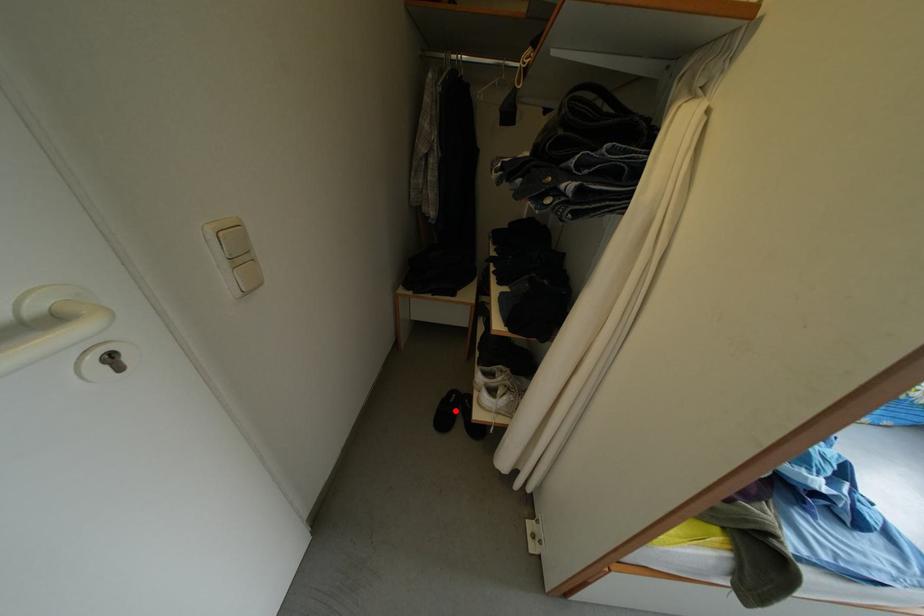
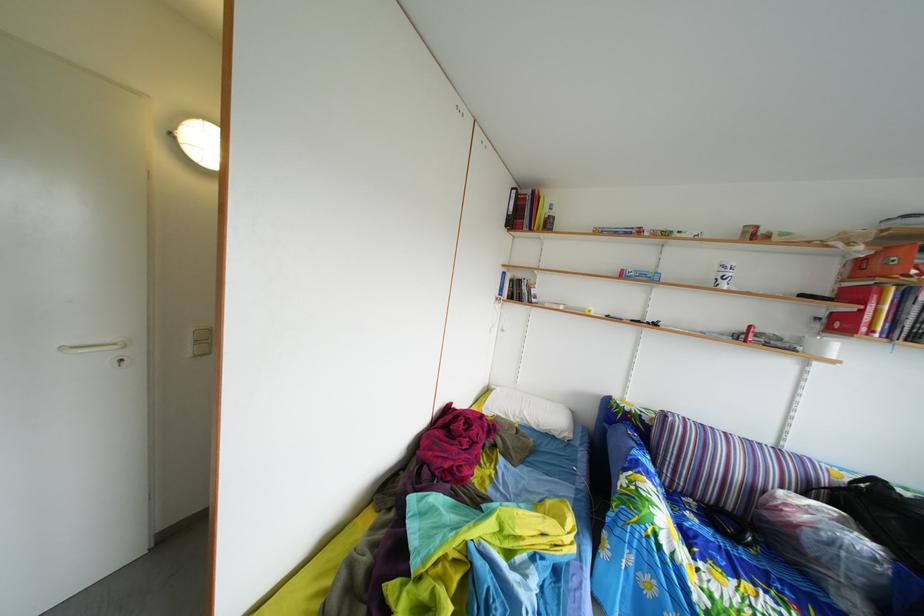
Question: I am providing you with two images of the same scene from different viewpoints. A red point is marked on the first image. Can you still see the location of the red point in image 2?

Choices:
 (A) Yes
 (B) No

Answer: (B)